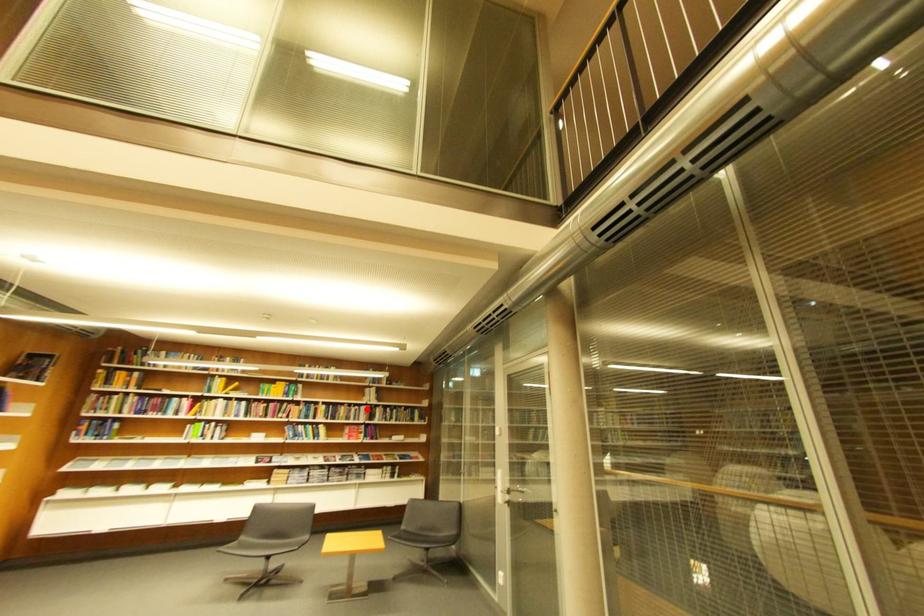
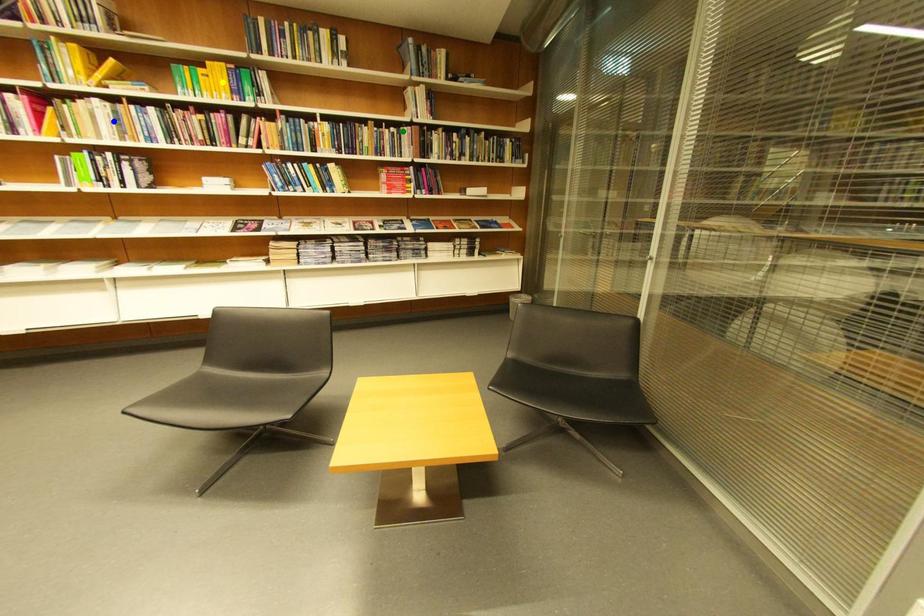
Question: I am providing you with two images of the same scene from different viewpoints. A red point is marked on the first image. You are given multiple points on the second image. In image 2, which mark is for the same physical point as the one in image 1?

Choices:
 (A) green point
 (B) blue point
 (C) yellow point

Answer: (A)